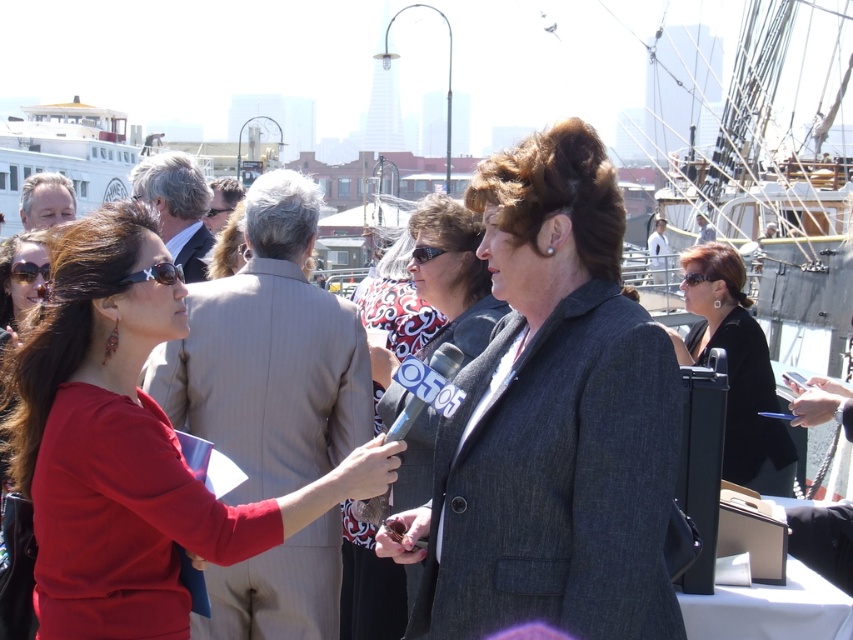
Question: Is gray wool blazer at center to the left of matte black blazer at center from the viewer's perspective?

Choices:
 (A) yes
 (B) no

Answer: (B)

Question: Which object appears closest to the camera in this image?

Choices:
 (A) matte black blazer at center
 (B) dark gray suit at center
 (C) white wooden ship at upper left
 (D) dark brown hair at center

Answer: (A)

Question: Estimate the real-world distances between objects in this image. Which object is closer to the light brown hair at upper left?

Choices:
 (A) white cotton shirt at center
 (B) black matte jacket at center
 (C) gray wool blazer at center
 (D) matte black blazer at center

Answer: (D)

Question: Is matte black blazer at center thinner than white wooden ship at upper left?

Choices:
 (A) yes
 (B) no

Answer: (A)

Question: Estimate the real-world distances between objects in this image. Which object is closer to the white cotton shirt at center?

Choices:
 (A) light brown suit at upper left
 (B) gray wool blazer at center

Answer: (A)

Question: Considering the relative positions of gray wool blazer at center and light brown hair at upper left in the image provided, where is gray wool blazer at center located with respect to light brown hair at upper left?

Choices:
 (A) above
 (B) below

Answer: (B)